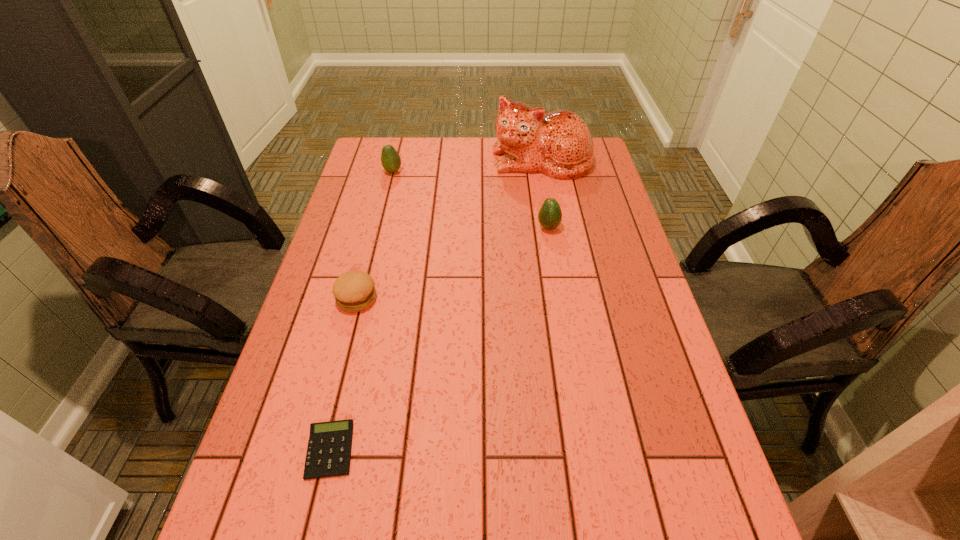
What are the coordinates of `the tallest object` in the screenshot? It's located at (559, 144).

The image size is (960, 540). In order to click on the farther avocado in this screenshot , I will do [x=390, y=159].

Identify the location of the third farthest object. (550, 215).

Where is `the nearer avocado`? The image size is (960, 540). the nearer avocado is located at coordinates (550, 215).

Locate an element on the screen. This screenshot has height=540, width=960. the second shortest object is located at coordinates (354, 291).

I want to click on hamburger, so click(x=354, y=291).

Where is `calculator`? calculator is located at coordinates (329, 448).

At what (x,y) coordinates should I click in order to perform the action: click on the nearest object. Please return your answer as a coordinate pair (x, y). Looking at the image, I should click on (329, 448).

The height and width of the screenshot is (540, 960). In order to click on vacant space located 0.240m on the face of the cat in this screenshot , I will do `click(553, 225)`.

You are a GUI agent. You are given a task and a screenshot of the screen. Output one action in this format:
    pyautogui.click(x=<x>, y=<y>)
    Task: Click on the free space located 0.090m on the left of the left avocado
    The width and height of the screenshot is (960, 540).
    Given the screenshot: What is the action you would take?
    pyautogui.click(x=358, y=172)